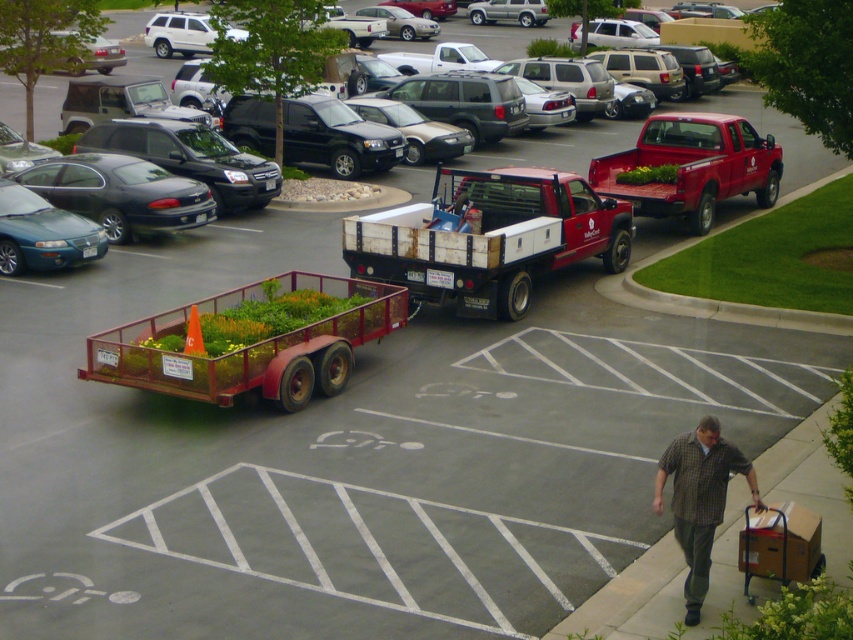
You are a delivery person trying to park your truck with the metallic red trailer at center in the parking lot. There is a matte black sedan at left already parked. Which vehicle should you move first to access the parking space behind them?

The metallic red trailer at center is closer to the viewer than the matte black sedan at left, so you should move the matte black sedan at left first to access the parking space behind them.

In the scene shown: You are a delivery driver who needs to park your vehicle in the parking lot shown. You see the matte white truck at center and the matte black sedan at left. Which vehicle is positioned closer to the entrance of the parking lot?

The matte white truck at center is closer to the entrance of the parking lot because it is closer to the viewer than the matte black sedan at left.